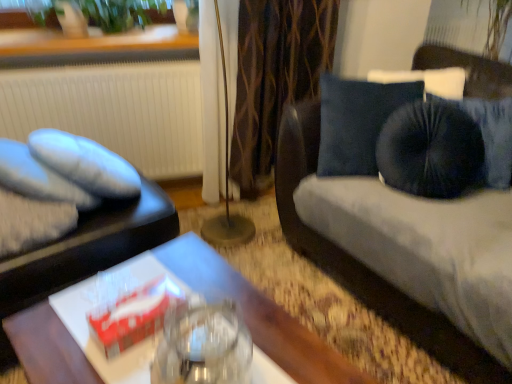
Describe the element at coordinates (260, 315) in the screenshot. I see `wooden table at center` at that location.

The height and width of the screenshot is (384, 512). Describe the element at coordinates (38, 178) in the screenshot. I see `soft gray fabric pillow at left` at that location.

From the picture: Measure the distance between point (155, 242) and camera.

The depth of point (155, 242) is 4.92 feet.

The image size is (512, 384). What do you see at coordinates (114, 110) in the screenshot?
I see `white textured radiator at left` at bounding box center [114, 110].

Looking at this image, measure the distance between point (224, 219) and camera.

They are 2.28 meters apart.

What is the approximate height of brown textured curtain at center?

The height of brown textured curtain at center is 33.64 inches.

This screenshot has width=512, height=384. I want to click on velvet blue studio couch at right, so click(x=362, y=264).

Based on the photo, would you say soft gray fabric pillow at left contains velvet blue studio couch at right?

No, velvet blue studio couch at right is located outside of soft gray fabric pillow at left.

From a real-world perspective, who is located higher, soft gray fabric pillow at left or velvet blue studio couch at right?

soft gray fabric pillow at left is physically above.

From the image's perspective, which object appears higher, soft gray fabric pillow at left or velvet blue studio couch at right?

velvet blue studio couch at right appears higher in the image.

Does metallic gold floor lamp at center touch soft gray fabric pillow at left?

No, metallic gold floor lamp at center is not in contact with soft gray fabric pillow at left.

From a real-world perspective, between metallic gold floor lamp at center and soft gray fabric pillow at left, who is vertically higher?

From a 3D spatial view, metallic gold floor lamp at center is above.

Which object is positioned more to the left, metallic gold floor lamp at center or soft gray fabric pillow at left?

soft gray fabric pillow at left is more to the left.

Which object is wider, metallic gold floor lamp at center or soft gray fabric pillow at left?

soft gray fabric pillow at left.

Considering the relative sizes of white textured radiator at left and soft gray fabric pillow at left in the image provided, is white textured radiator at left wider than soft gray fabric pillow at left?

Incorrect, the width of white textured radiator at left does not surpass that of soft gray fabric pillow at left.

How many degrees apart are the facing directions of white textured radiator at left and soft gray fabric pillow at left?

19.8 degrees.

Can you confirm if white textured radiator at left is smaller than soft gray fabric pillow at left?

No, white textured radiator at left is not smaller than soft gray fabric pillow at left.

Is white textured radiator at left facing away from soft gray fabric pillow at left?

No, soft gray fabric pillow at left is not at the back of white textured radiator at left.

Considering the relative sizes of white textured radiator at left and wooden table at center in the image provided, is white textured radiator at left thinner than wooden table at center?

Yes.

From the image's perspective, who appears lower, white textured radiator at left or wooden table at center?

wooden table at center, from the image's perspective.

Based on the photo, does white textured radiator at left have a larger size compared to wooden table at center?

Actually, white textured radiator at left might be smaller than wooden table at center.

In the scene shown: Is white textured radiator at left not close to wooden table at center?

Yes, white textured radiator at left and wooden table at center are quite far apart.

In the scene shown: Could you tell me if wooden table at center is turned towards green leafy plant at upper left?

No, wooden table at center is not facing towards green leafy plant at upper left.

Considering the relative sizes of wooden table at center and green leafy plant at upper left in the image provided, is wooden table at center smaller than green leafy plant at upper left?

No.

How different are the orientations of wooden table at center and green leafy plant at upper left in degrees?

24 degrees separate the facing orientations of wooden table at center and green leafy plant at upper left.

Considering the relative sizes of wooden table at center and green leafy plant at upper left in the image provided, is wooden table at center thinner than green leafy plant at upper left?

In fact, wooden table at center might be wider than green leafy plant at upper left.

Is point (345, 263) positioned before point (211, 281)?

No.

Does velvet blue studio couch at right turn towards wooden table at center?

Yes, velvet blue studio couch at right is aimed at wooden table at center.

In terms of size, does velvet blue studio couch at right appear bigger or smaller than wooden table at center?

velvet blue studio couch at right is bigger than wooden table at center.

From a real-world perspective, is velvet blue studio couch at right over wooden table at center?

Yes, from a real-world perspective, velvet blue studio couch at right is over wooden table at center

From the image's perspective, is soft gray fabric pillow at left located above brown textured curtain at center?

No, from the image's perspective, soft gray fabric pillow at left is not over brown textured curtain at center.

Is the depth of soft gray fabric pillow at left greater than that of brown textured curtain at center?

No.

What's the angular difference between soft gray fabric pillow at left and brown textured curtain at center's facing directions?

The angle between the facing direction of soft gray fabric pillow at left and the facing direction of brown textured curtain at center is 19.8 degrees.

From a real-world perspective, is soft gray fabric pillow at left on brown textured curtain at center?

No.

Where is `studio couch below the soft gray fabric pillow at left (from a real-world perspective)`? This screenshot has height=384, width=512. studio couch below the soft gray fabric pillow at left (from a real-world perspective) is located at coordinates [362, 264].

Where is `pillow in front of the metallic gold floor lamp at center`? This screenshot has height=384, width=512. pillow in front of the metallic gold floor lamp at center is located at coordinates (38, 178).

From the image, which object appears to be farther from white textured radiator at left, wooden table at center or metallic gold floor lamp at center?

Among the two, wooden table at center is located further to white textured radiator at left.

From the image, which object appears to be nearer to white textured radiator at left, matte black tray at left or metallic gold floor lamp at center?

Based on the image, metallic gold floor lamp at center appears to be nearer to white textured radiator at left.

Based on their spatial positions, is soft gray fabric pillow at left or green leafy plant at upper left further from white textured radiator at left?

The object further to white textured radiator at left is soft gray fabric pillow at left.

Looking at the image, which one is located closer to wooden table at center, matte black tray at left or brown textured curtain at center?

matte black tray at left is positioned closer to the anchor wooden table at center.

Based on their spatial positions, is matte black tray at left or velvet blue studio couch at right closer to white textured radiator at left?

Among the two, matte black tray at left is located nearer to white textured radiator at left.

Looking at the image, which one is located closer to white textured radiator at left, velvet blue studio couch at right or wooden table at center?

velvet blue studio couch at right is positioned closer to the anchor white textured radiator at left.

Which object lies further to the anchor point soft gray fabric pillow at left, wooden table at center or white textured radiator at left?

Based on the image, white textured radiator at left appears to be further to soft gray fabric pillow at left.

When comparing their distances from white textured radiator at left, does soft gray fabric pillow at left or velvet blue studio couch at right seem further?

velvet blue studio couch at right lies further to white textured radiator at left than the other object.

I want to click on radiator between green leafy plant at upper left and soft gray fabric pillow at left from top to bottom, so click(114, 110).

Where is `pillow located between matte black tray at left and white textured radiator at left in the depth direction`? Image resolution: width=512 pixels, height=384 pixels. pillow located between matte black tray at left and white textured radiator at left in the depth direction is located at coordinates (38, 178).

Where is `furniture situated between white textured radiator at left and metallic gold floor lamp at center from left to right`? The image size is (512, 384). furniture situated between white textured radiator at left and metallic gold floor lamp at center from left to right is located at coordinates (79, 213).

Locate an element on the screen. curtain between white textured radiator at left and velvet blue studio couch at right from left to right is located at coordinates (275, 77).